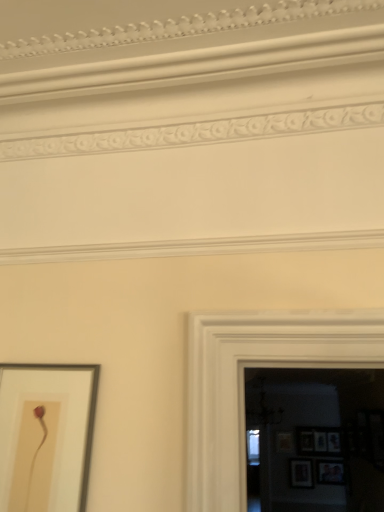
Question: Relative to wooden picture frame at lower right, placed as the second picture frame when sorted from right to left, is wooden picture frame at lower right, the fifth picture frame viewed from the top, in front or behind?

Choices:
 (A) front
 (B) behind

Answer: (A)

Question: Does point (299, 479) appear closer or farther from the camera than point (324, 453)?

Choices:
 (A) farther
 (B) closer

Answer: (B)

Question: Estimate the real-world distances between objects in this image. Which object is closer to the wooden picture frame at lower right, which is the 4th picture frame in left-to-right order?

Choices:
 (A) wooden picture frame at right, the 3th picture frame in the bottom-to-top sequence
 (B) matte wooden picture frame at lower right, the 2th picture frame positioned from the bottom
 (C) wooden picture frame at lower right, arranged as the 3th picture frame when viewed from the right
 (D) matte white picture frame at lower left, marked as the first picture frame in a front-to-back arrangement

Answer: (B)

Question: Which object is positioned farthest from the matte wooden picture frame at lower right, the second picture frame from the front?

Choices:
 (A) wooden picture frame at lower right, the 1th picture frame positioned from the bottom
 (B) matte white picture frame at lower left, which is counted as the 1th picture frame, starting from the left
 (C) wooden picture frame at right, the 1th picture frame in the back-to-front sequence
 (D) wooden picture frame at lower right, which ranks as the fourth picture frame in bottom-to-top order

Answer: (B)